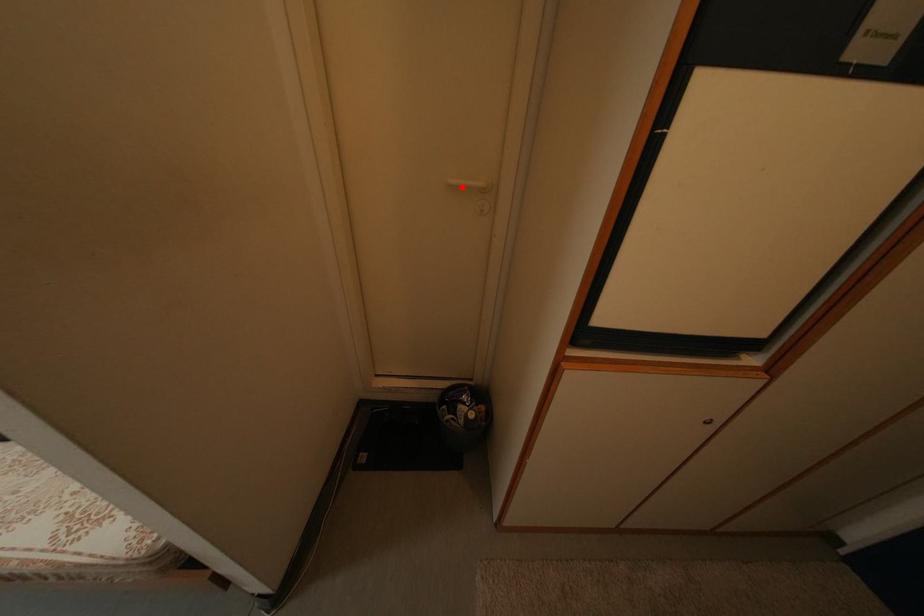
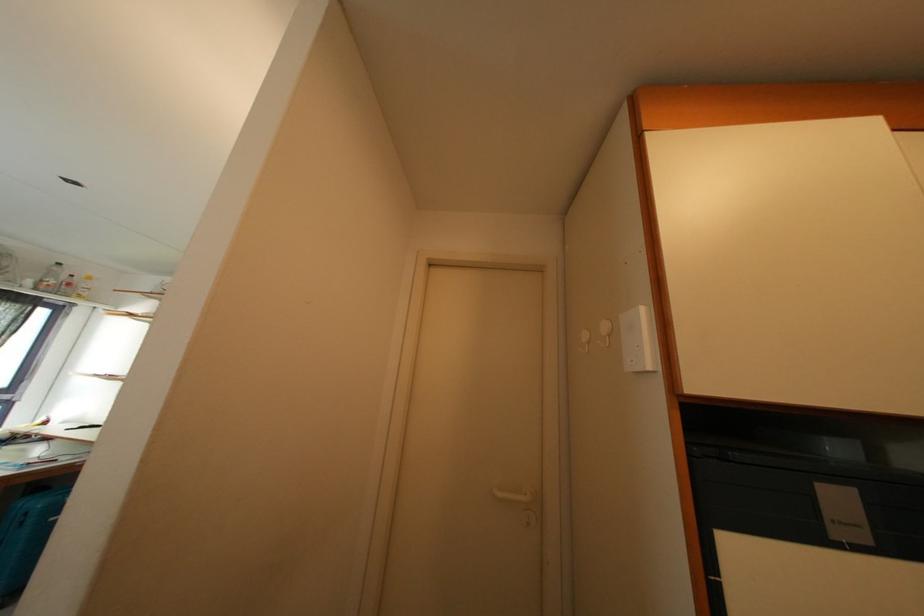
Where in the second image is the point corresponding to the highlighted location from the first image?

(507, 499)